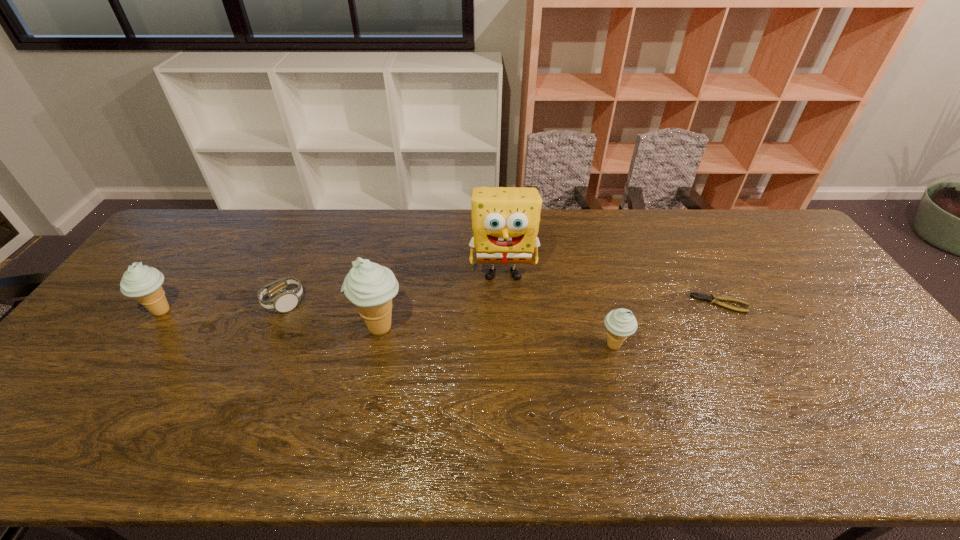
Where is `the third tallest object`? This screenshot has width=960, height=540. the third tallest object is located at coordinates (143, 283).

You are a GUI agent. You are given a task and a screenshot of the screen. Output one action in this format:
    pyautogui.click(x=<x>, y=<y>)
    Task: Click on the second shortest icecream
    The image size is (960, 540).
    Given the screenshot: What is the action you would take?
    pyautogui.click(x=143, y=283)

The image size is (960, 540). I want to click on the fourth object from right to left, so click(370, 286).

Find the location of a particular element. The height and width of the screenshot is (540, 960). the tallest icecream is located at coordinates (370, 286).

Where is `the rightmost icecream`? This screenshot has width=960, height=540. the rightmost icecream is located at coordinates (620, 323).

Where is `the shortest icecream`? Image resolution: width=960 pixels, height=540 pixels. the shortest icecream is located at coordinates (620, 323).

Find the location of a particular element. This screenshot has width=960, height=540. pliers is located at coordinates (711, 298).

Identify the location of the rightmost object. (711, 298).

I want to click on the third object from right to left, so click(x=505, y=220).

The height and width of the screenshot is (540, 960). What are the coordinates of `the second shortest object` in the screenshot? It's located at (286, 300).